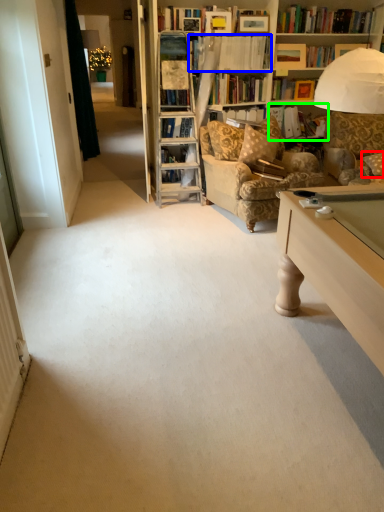
Question: Which is farther away from pillow (highlighted by a red box)? book (highlighted by a blue box) or book (highlighted by a green box)?

Choices:
 (A) book
 (B) book

Answer: (A)